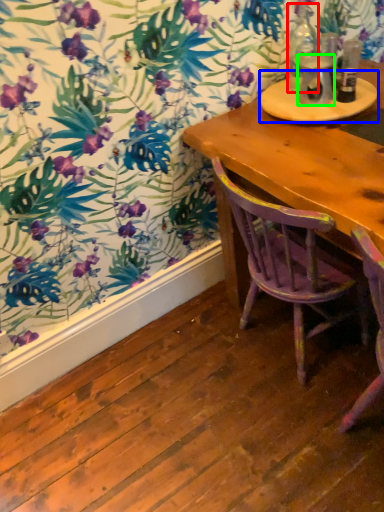
Question: Which object is the closest to the bottle (highlighted by a red box)? Choose among these: round table (highlighted by a blue box) or beverage (highlighted by a green box).

Choices:
 (A) round table
 (B) beverage

Answer: (B)